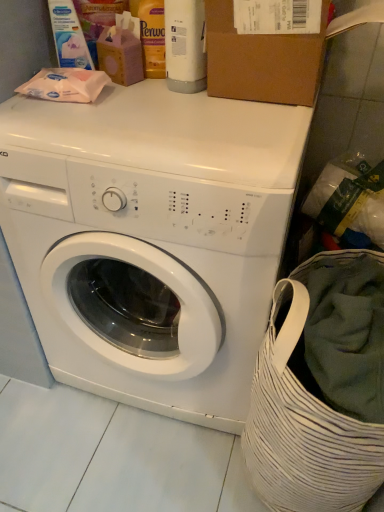
Where is `vacant space in front of white glossy bottle at upper center, acting as the 1th cleaning product starting from the right`? The image size is (384, 512). vacant space in front of white glossy bottle at upper center, acting as the 1th cleaning product starting from the right is located at coordinates (183, 114).